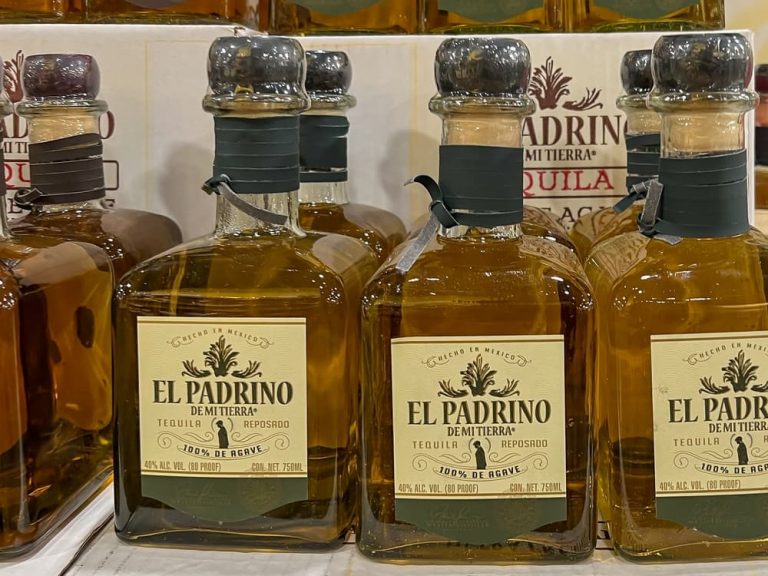
What are the coordinates of `white cardboard box` in the screenshot? It's located at (401, 100), (143, 85).